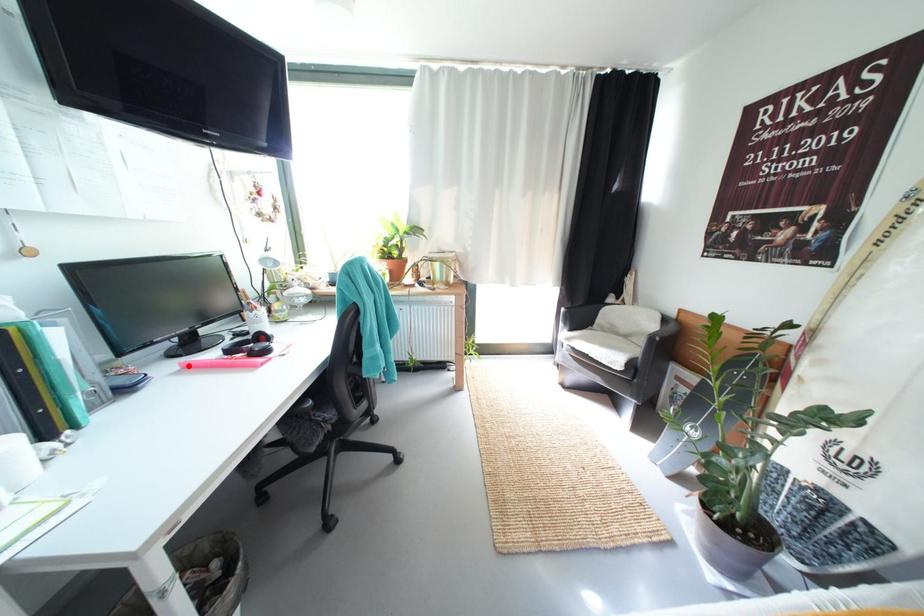
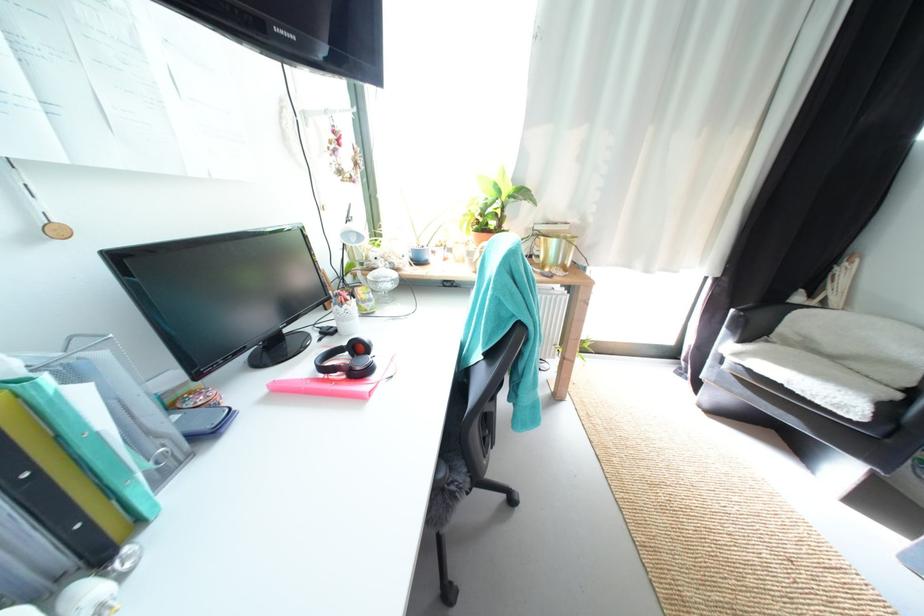
Question: I am providing you with two images of the same scene from different viewpoints. A red point is marked on the first image. Can you still see the location of the red point in image 2?

Choices:
 (A) Yes
 (B) No

Answer: (A)